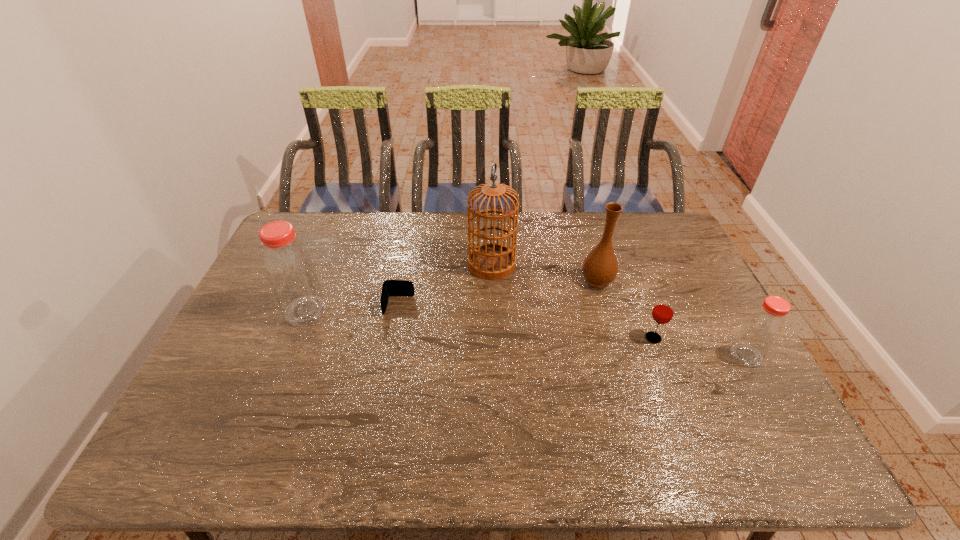
Find the location of a particular element. The image size is (960, 540). wallet is located at coordinates (390, 287).

Where is `free space located on the right of the leftmost object`? The image size is (960, 540). free space located on the right of the leftmost object is located at coordinates (380, 311).

The image size is (960, 540). In order to click on vacant region located 0.140m on the left of the rightmost object in this screenshot , I will do `click(679, 355)`.

Locate an element on the screen. free spot located 0.400m on the front of the birdcage is located at coordinates (495, 386).

At what (x,y) coordinates should I click in order to perform the action: click on vacant region located 0.350m on the back of the fifth tallest object. Please return your answer as a coordinate pair (x, y). Looking at the image, I should click on (621, 254).

Identify the location of vacant region located 0.280m on the right of the fourth object from left to right. Image resolution: width=960 pixels, height=540 pixels. (702, 280).

Where is `free space located on the outer surface of the wallet`? free space located on the outer surface of the wallet is located at coordinates (379, 407).

This screenshot has height=540, width=960. In order to click on object that is at the far edge in this screenshot , I will do `click(492, 261)`.

At what (x,y) coordinates should I click in order to perform the action: click on object positioned at the left edge. Please return your answer as a coordinate pair (x, y). This screenshot has height=540, width=960. Looking at the image, I should click on (289, 268).

Where is `object that is at the right edge`? This screenshot has width=960, height=540. object that is at the right edge is located at coordinates (760, 332).